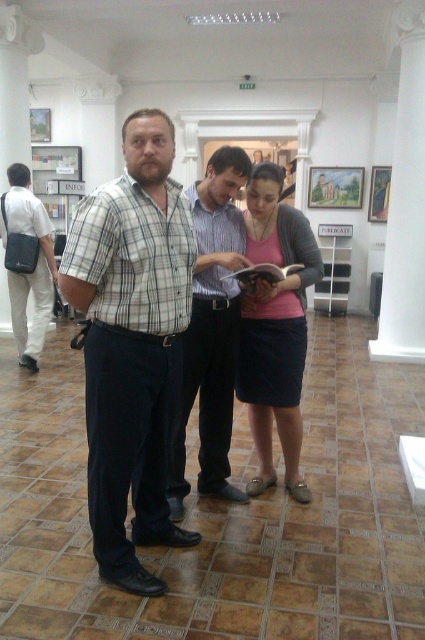
You are standing at the point marked as point (231,330) in the museum. You want to take a photo of the three people in the foreground using a camera that has a maximum focus range of 8 feet. Will you be able to focus on them clearly?

The distance between point (231,330) and the camera is 8.15 feet, which exceeds the camera maximum focus range of 8 feet. Therefore, the camera will not be able to focus on them clearly.

What is located at the coordinates point (133, 344)?

The plaid cotton shirt at center is located at point (133, 344).